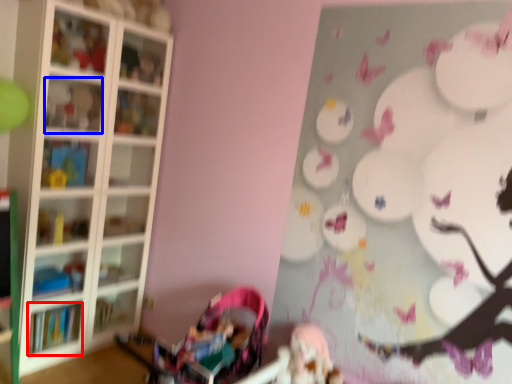
Question: Among these objects, which one is farthest to the camera, book (highlighted by a red box) or shelf (highlighted by a blue box)?

Choices:
 (A) book
 (B) shelf

Answer: (A)